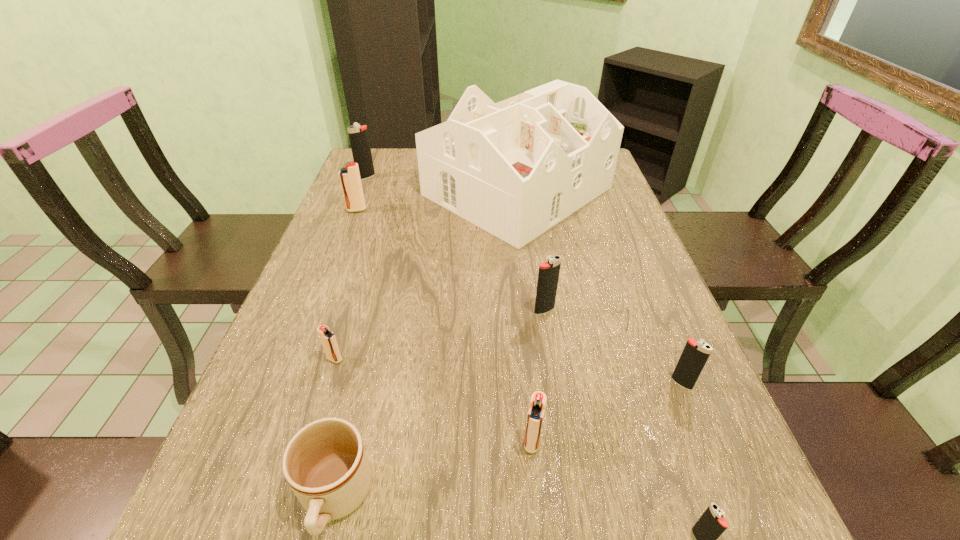
In the image, there is a desktop. At what (x,y) coordinates should I click in order to perform the action: click on blank space at the far left corner. Please return your answer as a coordinate pair (x, y). This screenshot has height=540, width=960. Looking at the image, I should click on (373, 165).

I want to click on vacant area that lies between the biggest red igniter and the fourth nearest igniter, so click(346, 285).

Identify the location of free space between the sixth farthest igniter and the sixth nearest igniter. (444, 326).

You are a GUI agent. You are given a task and a screenshot of the screen. Output one action in this format:
    pyautogui.click(x=<x>, y=<y>)
    Task: Click on the vacant area between the fifth igniter from left to right and the farthest black igniter
    Image resolution: width=960 pixels, height=540 pixels.
    Given the screenshot: What is the action you would take?
    pyautogui.click(x=455, y=244)

Where is `unoccupied position between the eighth shortest object and the fourth igniter from left to right`? unoccupied position between the eighth shortest object and the fourth igniter from left to right is located at coordinates (449, 309).

Where is `the closest object relative to the biggest red igniter`? the closest object relative to the biggest red igniter is located at coordinates (516, 168).

You are a GUI agent. You are given a task and a screenshot of the screen. Output one action in this format:
    pyautogui.click(x=<x>, y=<y>)
    Task: Click on the second closest object to the second igniter from right to left
    This screenshot has width=960, height=540.
    Given the screenshot: What is the action you would take?
    pyautogui.click(x=695, y=354)

In order to click on igniter identified as the closest to the farthest igniter in this screenshot , I will do click(x=350, y=180).

Locate an element on the screen. Image resolution: width=960 pixels, height=540 pixels. igniter that is the closest to the smallest black igniter is located at coordinates (536, 411).

I want to click on the third closest black igniter relative to the third black igniter from left to right, so click(x=358, y=135).